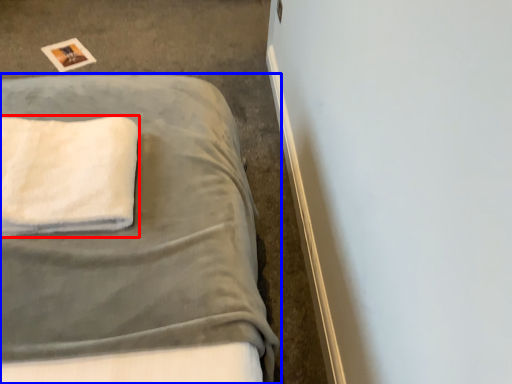
Question: Which of the following is the closest to the observer, towel (highlighted by a red box) or bed (highlighted by a blue box)?

Choices:
 (A) towel
 (B) bed

Answer: (A)